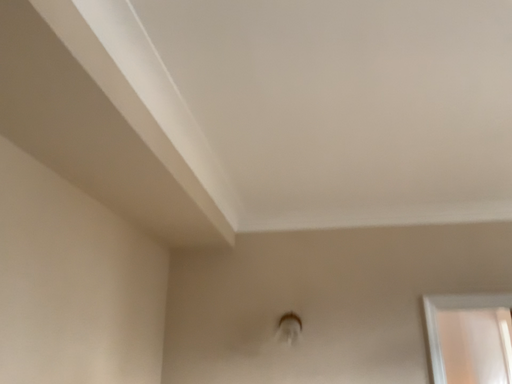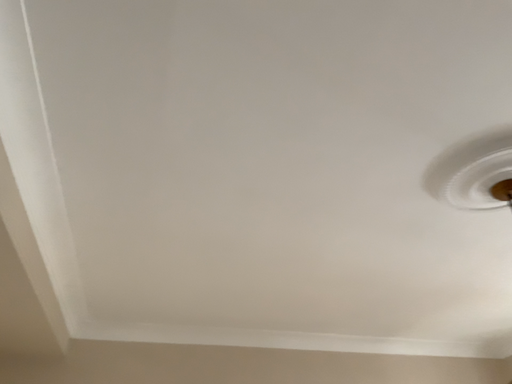
Question: How did the camera likely rotate when shooting the video?

Choices:
 (A) rotated right
 (B) rotated left

Answer: (A)